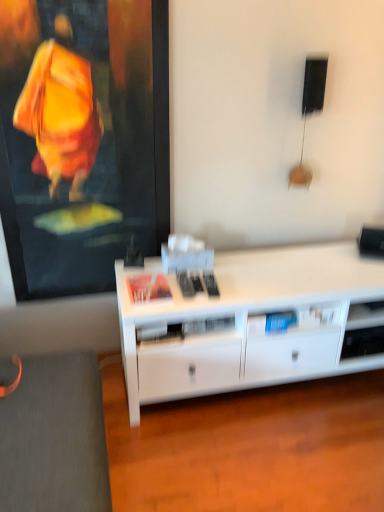
You are a GUI agent. You are given a task and a screenshot of the screen. Output one action in this format:
    pyautogui.click(x=<x>, y=<y>)
    Task: Click on the white matte desk at center
    Image resolution: width=384 pixels, height=512 pixels.
    Given the screenshot: What is the action you would take?
    pyautogui.click(x=246, y=321)

Consider the image. Measure the distance between point (168,328) and camera.

A distance of 5.97 feet exists between point (168,328) and camera.

What do you see at coordinates (246, 321) in the screenshot? I see `white matte desk at center` at bounding box center [246, 321].

Identify the location of textured fabric cushion at lower left. (55, 437).

What do you see at coordinates (55, 437) in the screenshot? The width and height of the screenshot is (384, 512). I see `textured fabric cushion at lower left` at bounding box center [55, 437].

What is the approximate width of textured fabric cushion at lower left?

textured fabric cushion at lower left is 27.44 inches wide.

The height and width of the screenshot is (512, 384). I want to click on white matte desk at center, so tap(246, 321).

From the picture: Is textured fabric cushion at lower left to the right of white matte desk at center from the viewer's perspective?

No, textured fabric cushion at lower left is not to the right of white matte desk at center.

Is textured fabric cushion at lower left further to camera compared to white matte desk at center?

No, textured fabric cushion at lower left is closer to the viewer.

Does point (51, 479) come in front of point (235, 372)?

Yes, point (51, 479) is closer to viewer.

From the image's perspective, which is below, textured fabric cushion at lower left or white matte desk at center?

From the image's view, textured fabric cushion at lower left is below.

From a real-world perspective, does textured fabric cushion at lower left stand above white matte desk at center?

No, from a real-world perspective, textured fabric cushion at lower left is not on top of white matte desk at center.

Is textured fabric cushion at lower left wider or thinner than white matte desk at center?

textured fabric cushion at lower left is wider than white matte desk at center.

Considering the sizes of objects textured fabric cushion at lower left and white matte desk at center in the image provided, who is taller, textured fabric cushion at lower left or white matte desk at center?

With more height is white matte desk at center.

Which of these two, textured fabric cushion at lower left or white matte desk at center, is bigger?

white matte desk at center is bigger.

Is textured fabric cushion at lower left spatially inside white matte desk at center, or outside of it?

textured fabric cushion at lower left is not enclosed by white matte desk at center.

Is there a large distance between textured fabric cushion at lower left and white matte desk at center?

No, textured fabric cushion at lower left is not far from white matte desk at center.

Based on the photo, is textured fabric cushion at lower left oriented away from white matte desk at center?

That's not correct — textured fabric cushion at lower left is not looking away from white matte desk at center.

What's the angular difference between textured fabric cushion at lower left and white matte desk at center's facing directions?

The angle between the facing direction of textured fabric cushion at lower left and the facing direction of white matte desk at center is 0.677 degrees.

Locate an element on the screen. This screenshot has width=384, height=512. gray on the left of the white matte desk at center is located at coordinates (55, 437).

Which is more to the left, white matte desk at center or textured fabric cushion at lower left?

Positioned to the left is textured fabric cushion at lower left.

In the image, is white matte desk at center positioned in front of or behind textured fabric cushion at lower left?

Clearly, white matte desk at center is behind textured fabric cushion at lower left.

Which point is more distant from viewer, (x=219, y=272) or (x=62, y=377)?

Positioned behind is point (x=219, y=272).

From the image's perspective, does white matte desk at center appear higher than textured fabric cushion at lower left?

Indeed, from the image's perspective, white matte desk at center is shown above textured fabric cushion at lower left.

From a real-world perspective, is white matte desk at center above or below textured fabric cushion at lower left?

Clearly, from a real-world perspective, white matte desk at center is above textured fabric cushion at lower left.

Between white matte desk at center and textured fabric cushion at lower left, which one has smaller width?

With smaller width is white matte desk at center.

Considering the sizes of white matte desk at center and textured fabric cushion at lower left in the image, is white matte desk at center taller or shorter than textured fabric cushion at lower left?

white matte desk at center is taller than textured fabric cushion at lower left.

Looking at the image, does white matte desk at center seem bigger or smaller compared to textured fabric cushion at lower left?

In the image, white matte desk at center appears to be larger than textured fabric cushion at lower left.

From the picture: Is white matte desk at center not inside textured fabric cushion at lower left?

Yes, white matte desk at center is outside of textured fabric cushion at lower left.

Would you say white matte desk at center is a long distance from textured fabric cushion at lower left?

Actually, white matte desk at center and textured fabric cushion at lower left are a little close together.

In the scene shown: Is white matte desk at center facing towards textured fabric cushion at lower left?

No, white matte desk at center does not turn towards textured fabric cushion at lower left.

How different are the orientations of white matte desk at center and textured fabric cushion at lower left in degrees?

white matte desk at center and textured fabric cushion at lower left are facing 0.677 degrees away from each other.

Measure the distance between white matte desk at center and textured fabric cushion at lower left.

white matte desk at center is 24.82 inches away from textured fabric cushion at lower left.

In the image, there is a white matte desk at center. At what (x,y) coordinates should I click in order to perform the action: click on gray below it (from the image's perspective). Please return your answer as a coordinate pair (x, y). The height and width of the screenshot is (512, 384). Looking at the image, I should click on (55, 437).

Where is `gray beneath the white matte desk at center (from a real-world perspective)`? gray beneath the white matte desk at center (from a real-world perspective) is located at coordinates (55, 437).

Where is `desk above the textured fabric cushion at lower left (from the image's perspective)`? desk above the textured fabric cushion at lower left (from the image's perspective) is located at coordinates (246, 321).